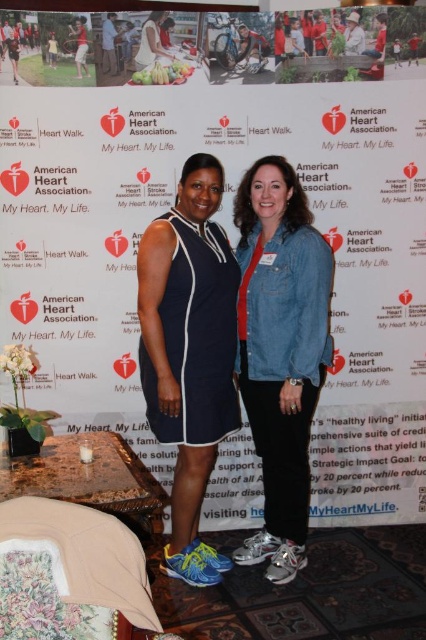
Question: Among these points, which one is nearest to the camera?

Choices:
 (A) (164, 56)
 (B) (276, 461)
 (C) (134, 323)

Answer: (B)

Question: Which point is closer to the camera?

Choices:
 (A) denim jacket at center
 (B) navy blue jersey dress at center
 (C) white paper at center
 (D) white satin dress at upper center

Answer: (A)

Question: Can you confirm if white paper at center is wider than denim jacket at center?

Choices:
 (A) no
 (B) yes

Answer: (B)

Question: Does white paper at center lie in front of navy blue jersey dress at center?

Choices:
 (A) yes
 (B) no

Answer: (B)

Question: Which point is farther to the camera?

Choices:
 (A) [170, 56]
 (B) [16, 307]
 (C) [170, 408]
 (D) [261, 561]

Answer: (B)

Question: Is the position of denim jacket at center more distant than that of white satin dress at upper center?

Choices:
 (A) no
 (B) yes

Answer: (A)